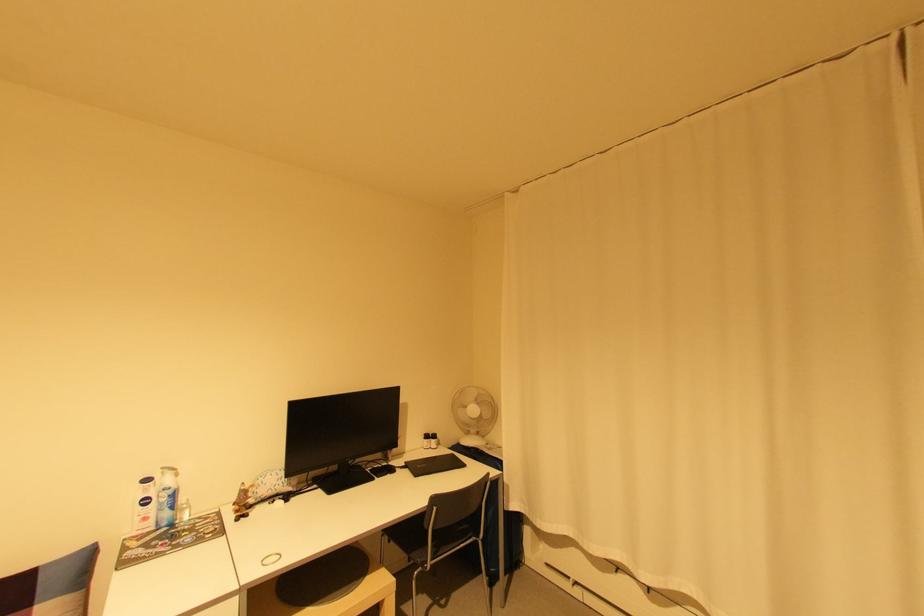
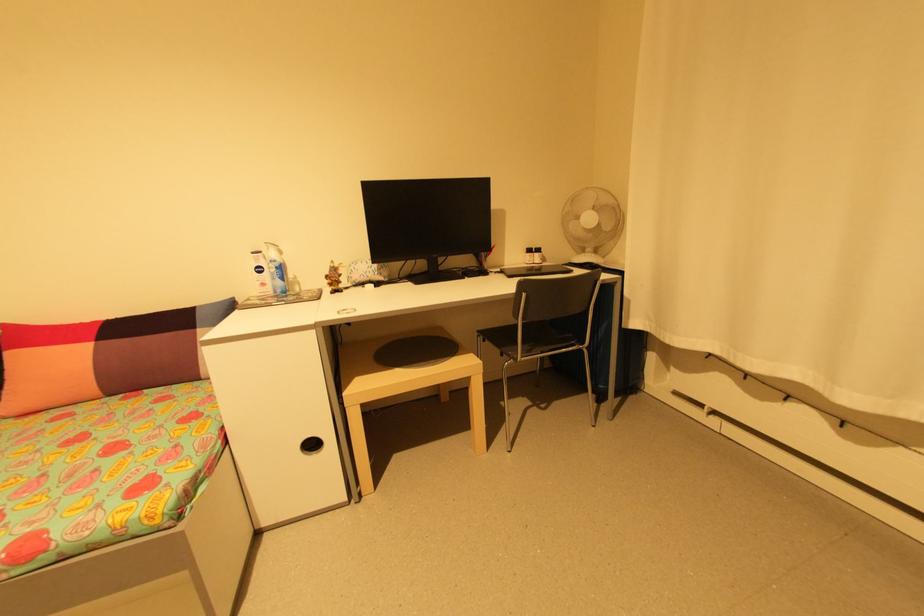
The point at (x=482, y=432) is marked in the first image. Where is the corresponding point in the second image?

(600, 252)